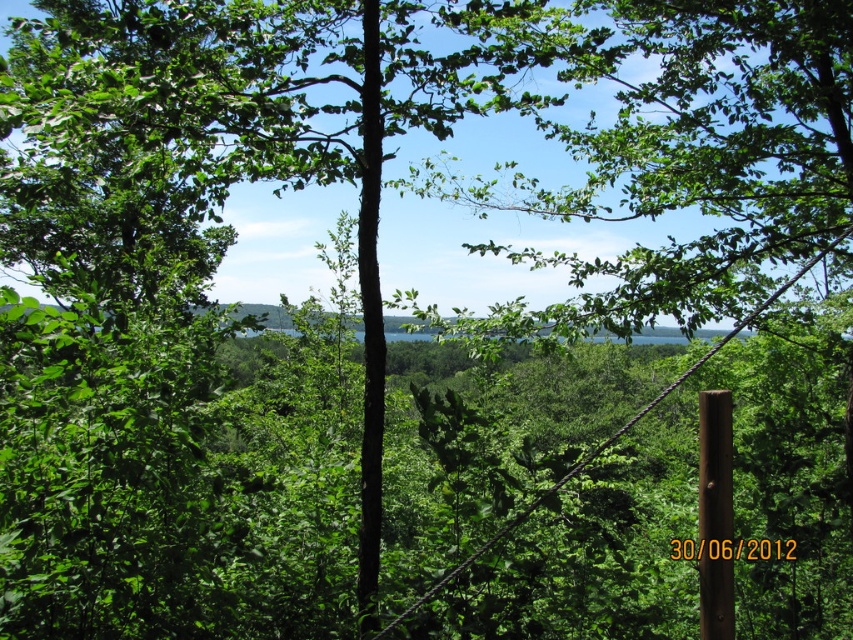
You are a hiker who wants to place a small sign on the smaller pole. Which pole should you choose between the black wood pole at center and the brown wooden pole at right?

The brown wooden pole at right is smaller than the black wood pole at center, so you should choose the brown wooden pole at right to place the small sign.

You are a hiker navigating through the forest and see the black wood pole at center and the brown wooden pole at right. Which pole is located more to the left side from your viewpoint?

The black wood pole at center is positioned on the left side of brown wooden pole at right, so it is more to the left.